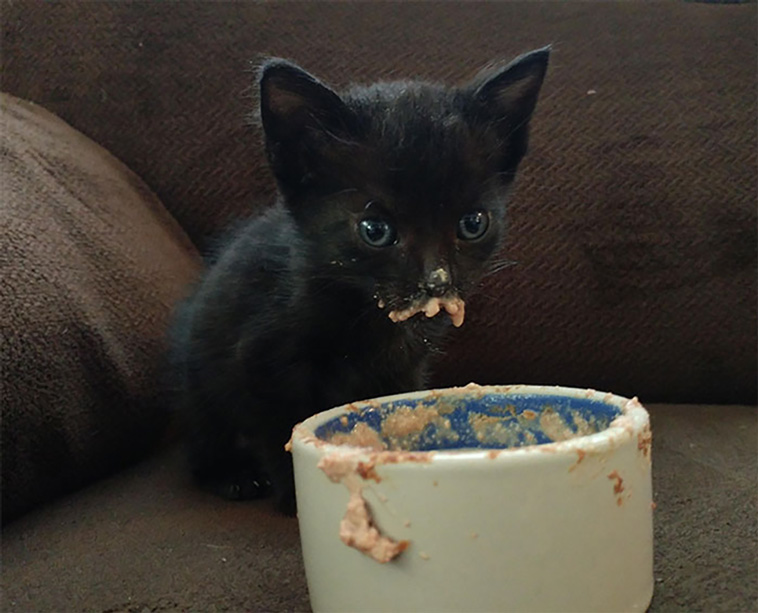
Find the location of a particular element. ceramic bowl is located at coordinates (512, 554).